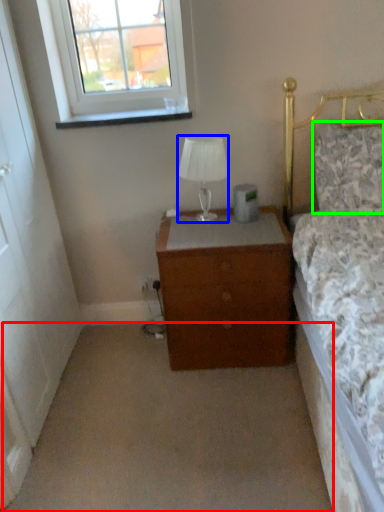
Question: Estimate the real-world distances between objects in this image. Which object is farther from plain (highlighted by a red box), lamp (highlighted by a blue box) or pillow (highlighted by a green box)?

Choices:
 (A) lamp
 (B) pillow

Answer: (B)